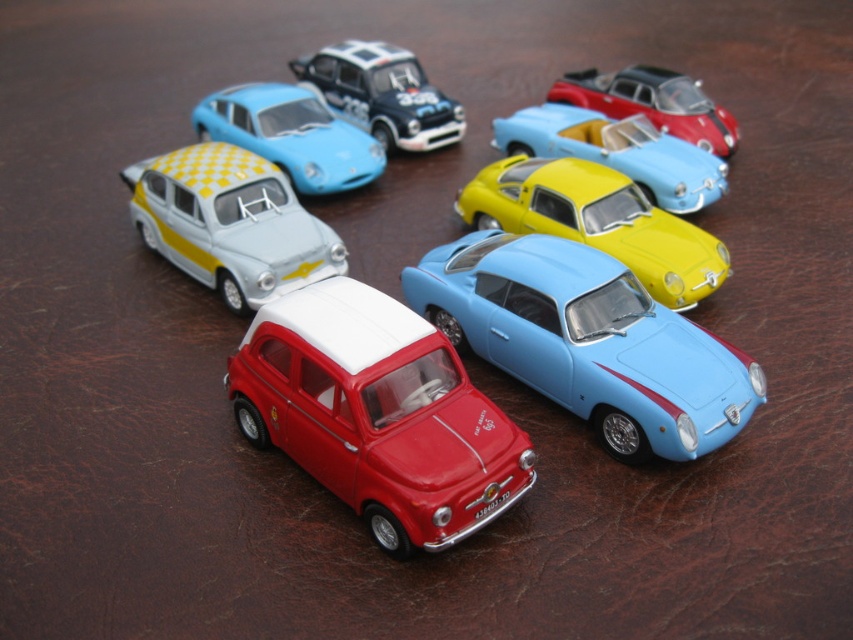
You are a collector looking at the arrangement of miniature cars on a dark brown leather surface. You notice the shiny red car at center and want to place a new model car exactly to its right. Based on the coordinates provided, where should you position the new car?

The shiny red car at center is located at coordinates point (376, 413). To place the new car exactly to its right, you should position it at a point with an x coordinate greater than 0.647 while keeping the y coordinate around 0.443.

From the picture: You are a collector who wants to place a new car model between the shiny red car at center and the shiny red car at upper right. Based on their widths, which side should you place the new car closer to?

The shiny red car at center is wider than the shiny red car at upper right. Therefore, you should place the new car closer to the shiny red car at upper right to maintain balance.

Looking at this image, you are a collector examining the miniature cars. You notice the checkered fabric car at upper left and the yellow glossy sports car at upper center. Which car is closer to you?

The checkered fabric car at upper left is closer to you than the yellow glossy sports car at upper center.